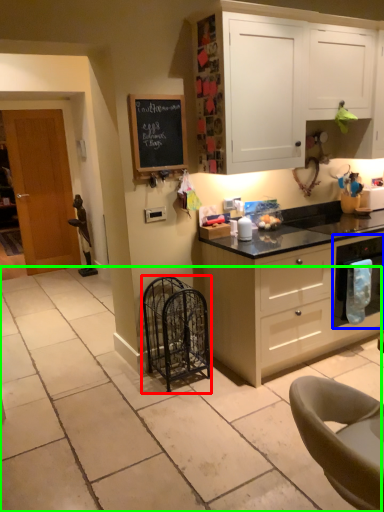
Question: Which object is positioned closest to cage (highlighted by a red box)? Select from kitchen appliance (highlighted by a blue box) and granite (highlighted by a green box).

Choices:
 (A) kitchen appliance
 (B) granite

Answer: (B)